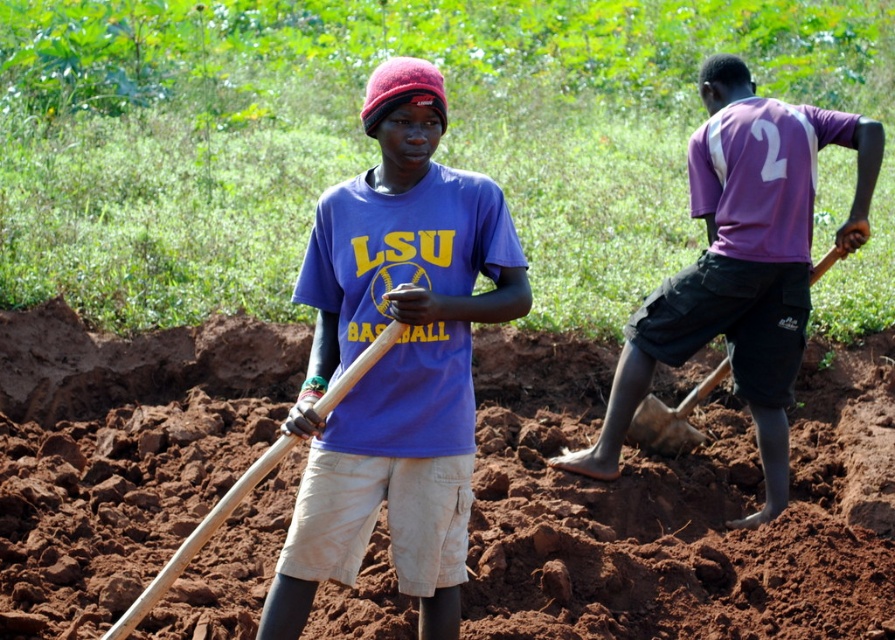
Based on the scene described, is the purple matte shirt at right positioned to the right or left of the wooden shovel at center?

The purple matte shirt at right is positioned to the right of the wooden shovel at center.

You are a photographer trying to capture both the blue matte shirt at center and the purple matte shirt at right in a single frame. Based on their sizes in the image, which shirt would appear smaller in the photo?

The blue matte shirt at center appears smaller in the photo because it has a lesser width compared to the purple matte shirt at right.

You are standing at the center of the image and want to hand a tool to the person wearing the purple matte shirt at right. In which direction should you move to approach them?

The purple matte shirt at right is located at point (740, 264), so you should move to the right and slightly forward to reach them.